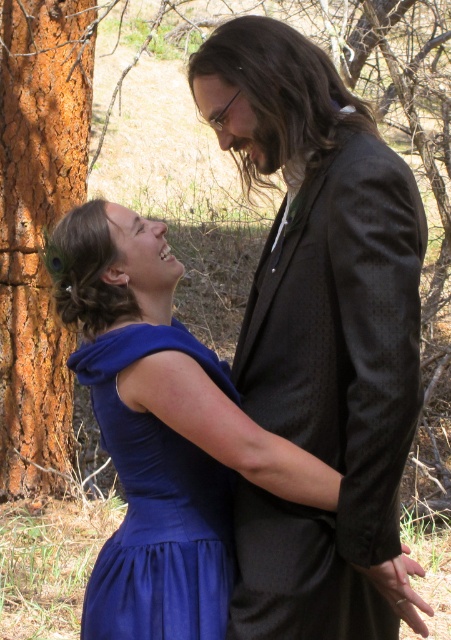
Question: Which object appears closest to the camera in this image?

Choices:
 (A) satin blue dress at center
 (B) orange rough bark tree at left
 (C) dark gray textured suit at center

Answer: (C)

Question: Is dark gray textured suit at center positioned before satin blue dress at center?

Choices:
 (A) yes
 (B) no

Answer: (A)

Question: Which point is farther to the camera?

Choices:
 (A) (355, 205)
 (B) (211, 550)

Answer: (B)

Question: Which object appears farthest from the camera in this image?

Choices:
 (A) satin blue dress at center
 (B) dark gray textured suit at center
 (C) orange rough bark tree at left

Answer: (C)

Question: Can you confirm if orange rough bark tree at left is positioned below satin blue dress at center?

Choices:
 (A) no
 (B) yes

Answer: (A)

Question: Can you confirm if dark gray textured suit at center is positioned to the right of satin blue dress at center?

Choices:
 (A) no
 (B) yes

Answer: (B)